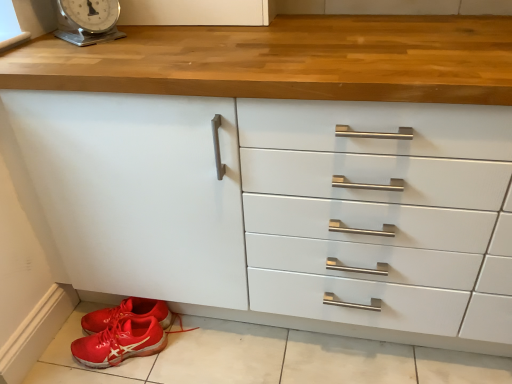
Question: Considering the relative sizes of red rubber shoe at lower left and metallic silver scale at upper left in the image provided, is red rubber shoe at lower left bigger than metallic silver scale at upper left?

Choices:
 (A) yes
 (B) no

Answer: (A)

Question: Would you say red rubber shoe at lower left is a long distance from metallic silver scale at upper left?

Choices:
 (A) no
 (B) yes

Answer: (A)

Question: Is red rubber shoe at lower left oriented towards metallic silver scale at upper left?

Choices:
 (A) no
 (B) yes

Answer: (A)

Question: Is red rubber shoe at lower left wider than metallic silver scale at upper left?

Choices:
 (A) no
 (B) yes

Answer: (A)

Question: Can you confirm if red rubber shoe at lower left is positioned to the left of metallic silver scale at upper left?

Choices:
 (A) no
 (B) yes

Answer: (A)

Question: Is metallic silver scale at upper left inside red rubber shoe at lower left?

Choices:
 (A) no
 (B) yes

Answer: (A)

Question: Considering the relative sizes of metallic silver scale at upper left and red rubber shoe at lower left in the image provided, is metallic silver scale at upper left shorter than red rubber shoe at lower left?

Choices:
 (A) no
 (B) yes

Answer: (B)

Question: Does metallic silver scale at upper left have a greater width compared to red rubber shoe at lower left?

Choices:
 (A) no
 (B) yes

Answer: (B)

Question: From the image's perspective, would you say metallic silver scale at upper left is positioned over red rubber shoe at lower left?

Choices:
 (A) yes
 (B) no

Answer: (A)

Question: Is metallic silver scale at upper left further to camera compared to red rubber shoe at lower left?

Choices:
 (A) yes
 (B) no

Answer: (B)

Question: Considering the relative sizes of metallic silver scale at upper left and red rubber shoe at lower left in the image provided, is metallic silver scale at upper left smaller than red rubber shoe at lower left?

Choices:
 (A) yes
 (B) no

Answer: (A)

Question: Are metallic silver scale at upper left and red rubber shoe at lower left making contact?

Choices:
 (A) yes
 (B) no

Answer: (B)

Question: Considering the relative sizes of red rubber shoe at lower left and shiny red sneakers at lower left in the image provided, is red rubber shoe at lower left thinner than shiny red sneakers at lower left?

Choices:
 (A) no
 (B) yes

Answer: (A)